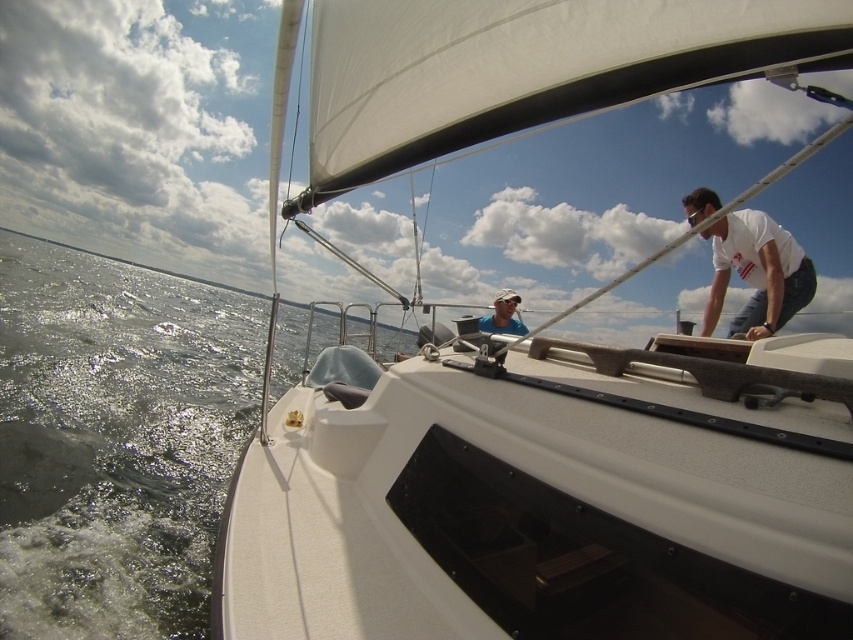
You are on a sailboat and need to determine the position of two points marked on the deck. The first point is at coordinates point (180, 365) and the second is at point (514, 333). Which point is closer to you?

Point (180, 365) is closer to you because it is further to the viewer than point (514, 333).

You are on a sailboat and need to hand a message to both the person in the white cotton shirt at upper right and the person in the matte blue shirt at center. Which person should you approach first if you want to reach the one higher up on the boat?

The white cotton shirt at upper right is located above the matte blue shirt at center, so you should approach the person in the white cotton shirt at upper right first since they are higher up on the boat.

You are standing on the deck of the sailboat and want to retrieve a floating item that is 6 feet away from you. The greenish water at lower left is where the item is located. Can you reach it without moving from your current position?

The greenish water at lower left is 6.44 feet away from the viewer. Since the item is 6 feet away, it is within reach as the distance is slightly more than 6 feet, so you can reach it without moving.